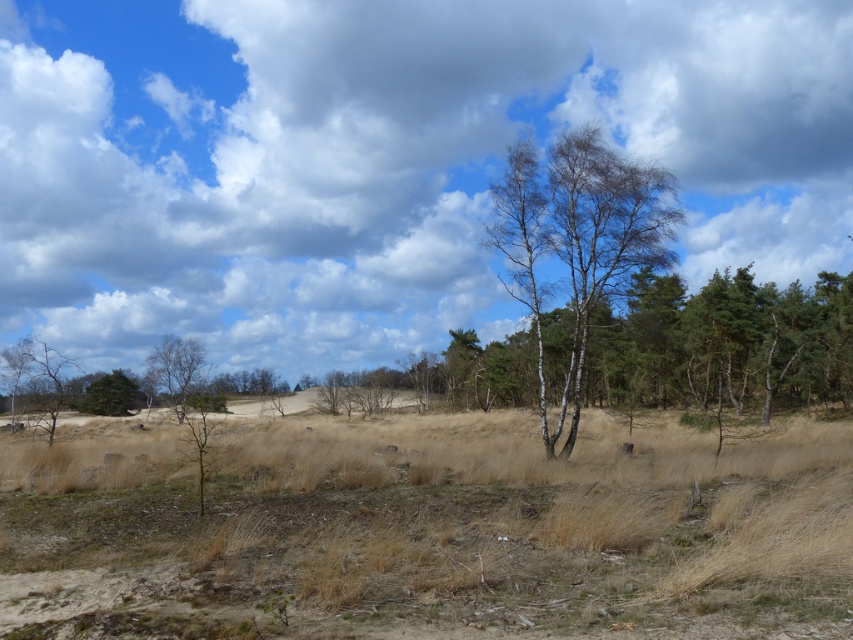
You are standing at the point with coordinates point (581,221) and want to walk to point (134,394). Which direction should you move to get closer to your destination?

You should move downward because point (581,221) is closer to the viewer than point (134,394), so moving downward would take you towards the destination.

You are standing in the dry grassy area looking towards the slope. Which object, the white fluffy cloud at upper center or the bare birch trees at center, is closer to you?

The bare birch trees at center are closer to you than the white fluffy cloud at upper center because the cloud is further away.